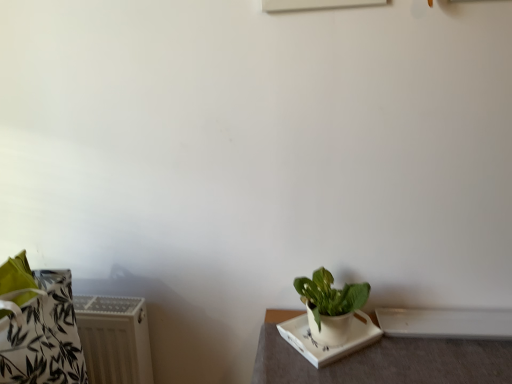
Question: From a real-world perspective, is white ceramic tray at lower right on green matte plant at lower right?

Choices:
 (A) yes
 (B) no

Answer: (B)

Question: Is white ceramic tray at lower right oriented towards green matte plant at lower right?

Choices:
 (A) yes
 (B) no

Answer: (B)

Question: Is white ceramic tray at lower right outside green matte plant at lower right?

Choices:
 (A) yes
 (B) no

Answer: (A)

Question: Does white ceramic tray at lower right have a larger size compared to green matte plant at lower right?

Choices:
 (A) no
 (B) yes

Answer: (B)

Question: Considering the relative positions of white ceramic tray at lower right and green matte plant at lower right in the image provided, is white ceramic tray at lower right behind green matte plant at lower right?

Choices:
 (A) yes
 (B) no

Answer: (B)

Question: Considering the positions of white ceramic plate at lower right and green matte plant at lower right in the image, is white ceramic plate at lower right taller or shorter than green matte plant at lower right?

Choices:
 (A) tall
 (B) short

Answer: (B)

Question: In terms of width, does white ceramic plate at lower right look wider or thinner when compared to green matte plant at lower right?

Choices:
 (A) wide
 (B) thin

Answer: (A)

Question: Is white ceramic plate at lower right inside or outside of green matte plant at lower right?

Choices:
 (A) outside
 (B) inside

Answer: (B)

Question: From a real-world perspective, is white ceramic plate at lower right positioned above or below green matte plant at lower right?

Choices:
 (A) below
 (B) above

Answer: (A)

Question: From a real-world perspective, is green matte plant at lower right physically located above or below white textured radiator at lower left?

Choices:
 (A) above
 (B) below

Answer: (A)

Question: Considering the positions of point (342, 317) and point (136, 331), is point (342, 317) closer or farther from the camera than point (136, 331)?

Choices:
 (A) closer
 (B) farther

Answer: (A)

Question: Is green matte plant at lower right inside the boundaries of white textured radiator at lower left, or outside?

Choices:
 (A) outside
 (B) inside

Answer: (A)

Question: In terms of height, does green matte plant at lower right look taller or shorter compared to white textured radiator at lower left?

Choices:
 (A) tall
 (B) short

Answer: (B)

Question: From a real-world perspective, relative to white ceramic tray at lower right, is white glossy window sill at lower right vertically above or below?

Choices:
 (A) below
 (B) above

Answer: (B)

Question: From their relative heights in the image, would you say white glossy window sill at lower right is taller or shorter than white ceramic tray at lower right?

Choices:
 (A) tall
 (B) short

Answer: (B)